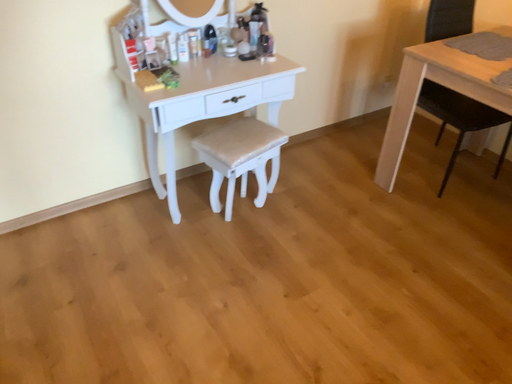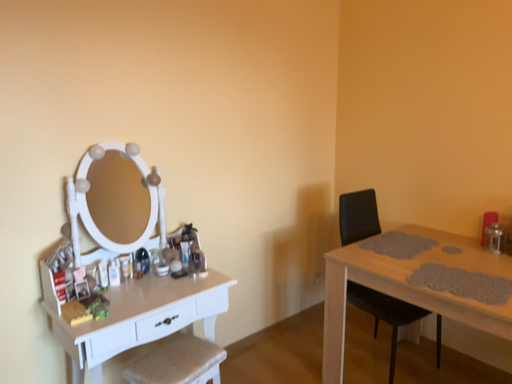
Question: How did the camera likely rotate when shooting the video?

Choices:
 (A) rotated right
 (B) rotated left

Answer: (A)